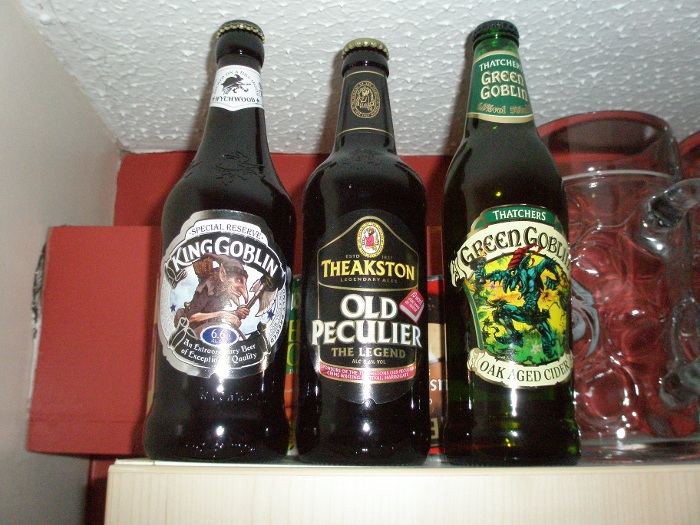
Where is `mug`? The width and height of the screenshot is (700, 525). mug is located at coordinates tap(615, 321).